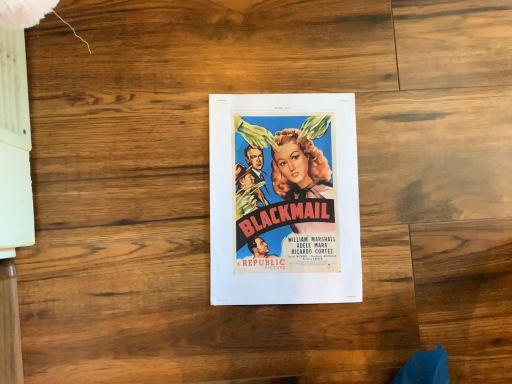
The image size is (512, 384). What are the coordinates of `free space above matte paper poster at center (from a real-world perspective)` in the screenshot? It's located at (286, 189).